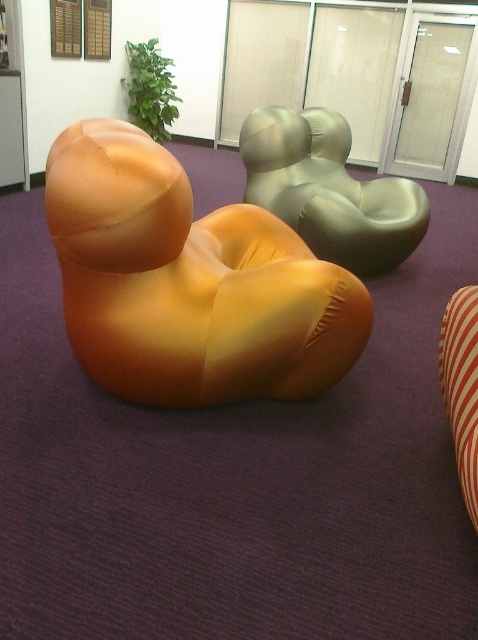
Question: Which object is farther from the camera taking this photo?

Choices:
 (A) metallic green chair at center
 (B) matte orange bean bag at center

Answer: (A)

Question: Is matte orange bean bag at center positioned at the back of metallic green chair at center?

Choices:
 (A) yes
 (B) no

Answer: (B)

Question: In this image, where is matte orange bean bag at center located relative to metallic green chair at center?

Choices:
 (A) below
 (B) above

Answer: (A)

Question: Which object is closer to the camera taking this photo?

Choices:
 (A) metallic green chair at center
 (B) matte orange bean bag at center

Answer: (B)

Question: From the image, what is the correct spatial relationship of matte orange bean bag at center in relation to metallic green chair at center?

Choices:
 (A) above
 (B) below

Answer: (B)